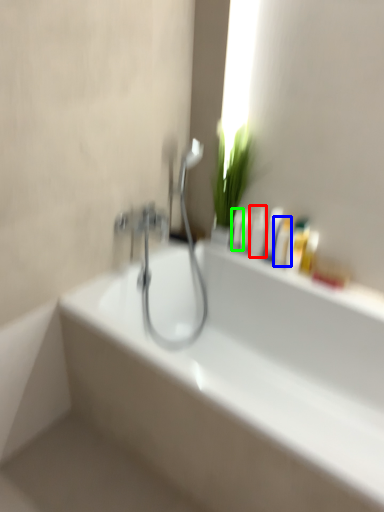
Question: Which is nearer to the mouthwash (highlighted by a red box)? mouthwash (highlighted by a blue box) or mouthwash (highlighted by a green box).

Choices:
 (A) mouthwash
 (B) mouthwash

Answer: (B)